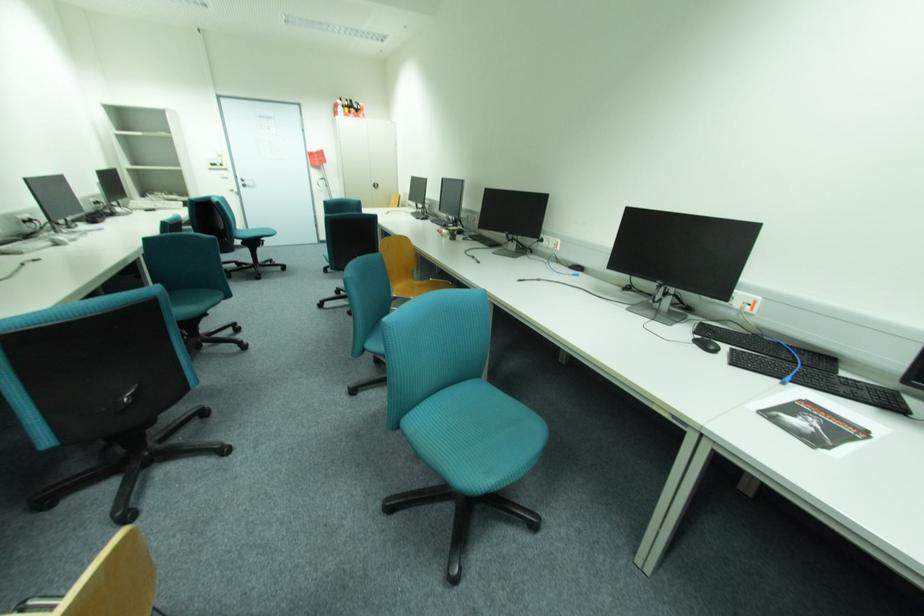
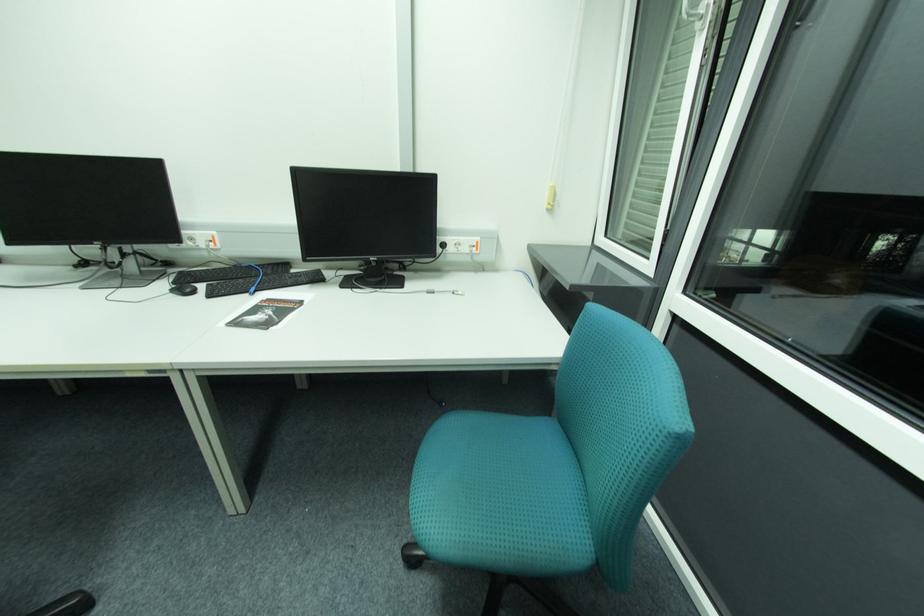
Locate, in the second image, the point that corresponds to pixel 807 400 in the first image.

(270, 301)